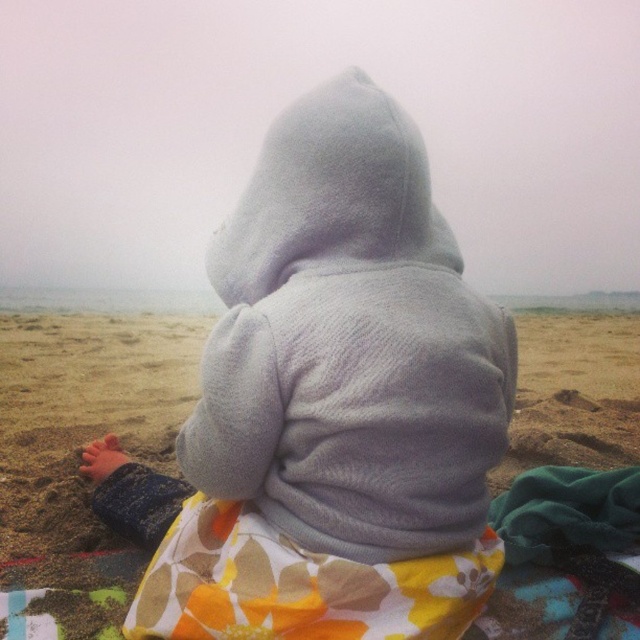
Question: In this image, where is soft sand at center located relative to printed cotton blanket at center?

Choices:
 (A) right
 (B) left

Answer: (A)

Question: Can you confirm if soft sand at center is bigger than printed cotton blanket at center?

Choices:
 (A) yes
 (B) no

Answer: (A)

Question: Which object appears closest to the camera in this image?

Choices:
 (A) printed cotton blanket at center
 (B) soft sand at center

Answer: (A)

Question: Does soft sand at center appear on the left side of printed cotton blanket at center?

Choices:
 (A) yes
 (B) no

Answer: (B)

Question: Which point is closer to the camera?

Choices:
 (A) printed cotton blanket at center
 (B) gray fleece hoodie at center
 (C) soft sand at center

Answer: (B)

Question: Which object is positioned farthest from the gray fleece hoodie at center?

Choices:
 (A) printed cotton blanket at center
 (B) soft sand at center

Answer: (B)